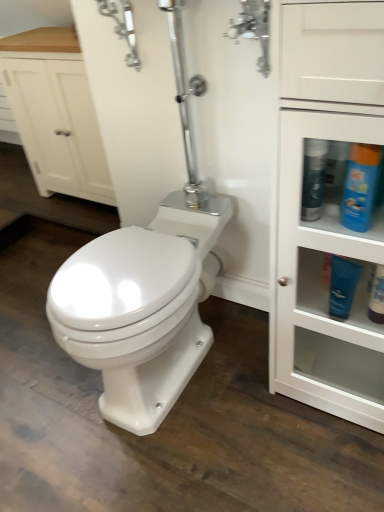
The width and height of the screenshot is (384, 512). Find the location of `free spot in front of white glossy cabinet at right`. free spot in front of white glossy cabinet at right is located at coordinates (320, 463).